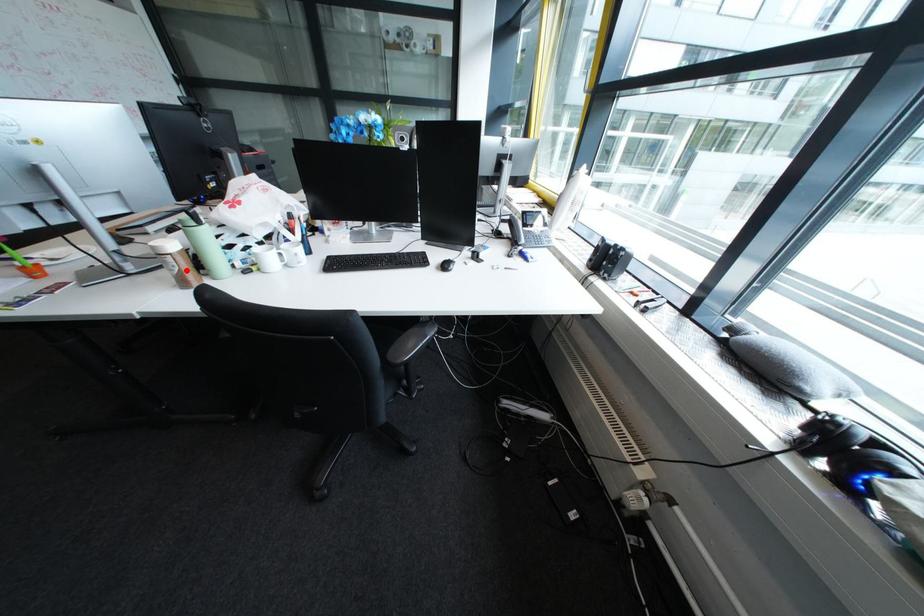
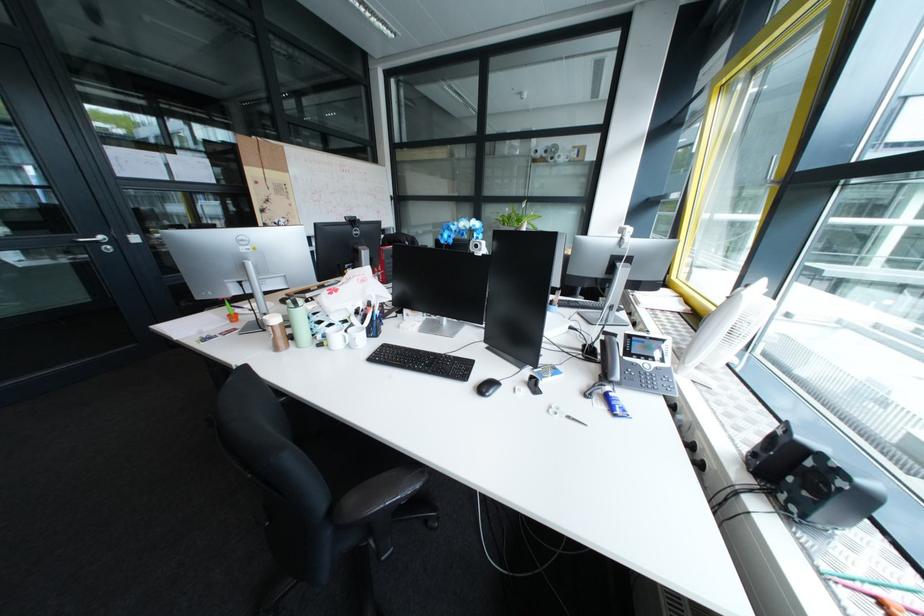
In the second image, find the point that corresponds to the highlighted location in the first image.

(284, 338)